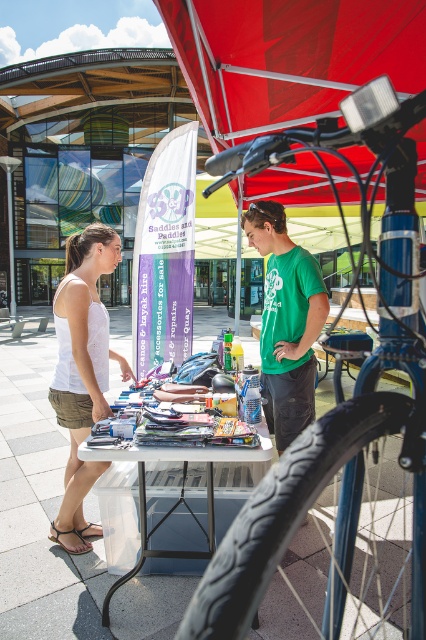
Question: Which point is farther to the camera?

Choices:
 (A) white fabric tank top at left
 (B) white plastic table at center

Answer: (A)

Question: Is red fabric canopy at upper center bigger than white fabric tank top at left?

Choices:
 (A) yes
 (B) no

Answer: (A)

Question: Can you confirm if blue metallic bicycle at center is positioned above white fabric tank top at left?

Choices:
 (A) no
 (B) yes

Answer: (A)

Question: Which object is farther from the camera taking this photo?

Choices:
 (A) green cotton t-shirt at center
 (B) white plastic table at center
 (C) blue metallic bicycle at center

Answer: (A)

Question: Is white plastic table at center bigger than white fabric tank top at left?

Choices:
 (A) no
 (B) yes

Answer: (A)

Question: Which object is closer to the camera taking this photo?

Choices:
 (A) white plastic table at center
 (B) green cotton t-shirt at center
 (C) white fabric tank top at left
 (D) red fabric canopy at upper center

Answer: (A)